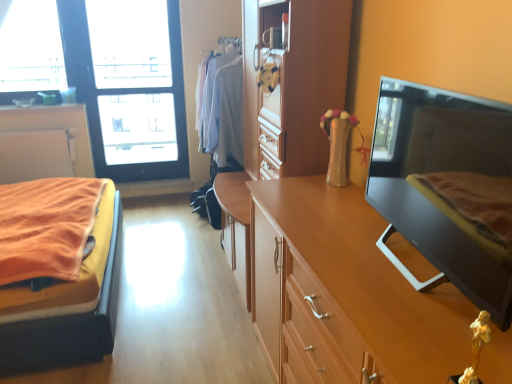
Where is `free space above wooden cabinet at right, the 1th cabinetry in the front-to-back sequence (from a real-world perspective)`? Image resolution: width=512 pixels, height=384 pixels. free space above wooden cabinet at right, the 1th cabinetry in the front-to-back sequence (from a real-world perspective) is located at coordinates (x=350, y=227).